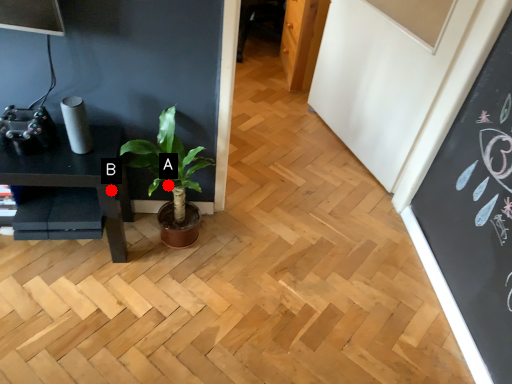
Question: Two points are circled on the image, labeled by A and B beside each circle. Among these points, which one is farthest from the camera?

Choices:
 (A) A is further
 (B) B is further

Answer: (A)